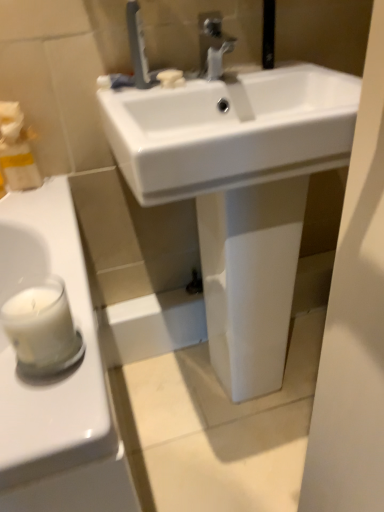
What do you see at coordinates (138, 47) in the screenshot? The image size is (384, 512). I see `satin nickel faucet at upper center, the 1th tap positioned from the left` at bounding box center [138, 47].

Identify the location of matte silver faucet at upper center, which is the 1th tap in right-to-left order. (213, 45).

What do you see at coordinates (239, 191) in the screenshot? I see `white glossy sink at center` at bounding box center [239, 191].

Locate an element on the screen. The width and height of the screenshot is (384, 512). satin nickel faucet at upper center, which is the second tap from right to left is located at coordinates (138, 47).

Considering the sizes of matte silver faucet at upper center, acting as the second tap starting from the left, and satin nickel faucet at upper center, the 1th tap positioned from the left, in the image, is matte silver faucet at upper center, acting as the second tap starting from the left, wider or thinner than satin nickel faucet at upper center, the 1th tap positioned from the left,?

Clearly, matte silver faucet at upper center, acting as the second tap starting from the left, has more width compared to satin nickel faucet at upper center, the 1th tap positioned from the left.

Looking at this image, from the image's perspective, between matte silver faucet at upper center, acting as the second tap starting from the left, and satin nickel faucet at upper center, the 1th tap positioned from the left, which one is located above?

satin nickel faucet at upper center, the 1th tap positioned from the left, appears higher in the image.

Is matte silver faucet at upper center, acting as the second tap starting from the left, completely or partially outside of satin nickel faucet at upper center, the 1th tap positioned from the left?

matte silver faucet at upper center, acting as the second tap starting from the left, lies outside satin nickel faucet at upper center, the 1th tap positioned from the left,'s area.

I want to click on the 1st tap to the right of the white wax candle at left, counting from the anchor's position, so click(138, 47).

Can you confirm if satin nickel faucet at upper center, which is the second tap from right to left, is positioned to the left of white wax candle at left?

In fact, satin nickel faucet at upper center, which is the second tap from right to left, is to the right of white wax candle at left.

From the image's perspective, which is above, satin nickel faucet at upper center, which is the second tap from right to left, or white wax candle at left?

satin nickel faucet at upper center, which is the second tap from right to left, from the image's perspective.

In terms of size, does satin nickel faucet at upper center, the 1th tap positioned from the left, appear bigger or smaller than white glossy sink at center?

satin nickel faucet at upper center, the 1th tap positioned from the left, is smaller than white glossy sink at center.

Based on the photo, which of these two, satin nickel faucet at upper center, the 1th tap positioned from the left, or white glossy sink at center, stands shorter?

satin nickel faucet at upper center, the 1th tap positioned from the left, is shorter.

Does satin nickel faucet at upper center, which is the second tap from right to left, have a greater width compared to white glossy sink at center?

No.

Based on the photo, is white wax candle at left wider or thinner than matte silver faucet at upper center, acting as the second tap starting from the left?

Considering their sizes, white wax candle at left looks slimmer than matte silver faucet at upper center, acting as the second tap starting from the left.

Is white wax candle at left looking in the opposite direction of matte silver faucet at upper center, acting as the second tap starting from the left?

white wax candle at left is not turned away from matte silver faucet at upper center, acting as the second tap starting from the left.

Does white wax candle at left have a greater height compared to matte silver faucet at upper center, acting as the second tap starting from the left?

Incorrect, the height of white wax candle at left is not larger of that of matte silver faucet at upper center, acting as the second tap starting from the left.

Is white glossy sink at center not close to matte silver faucet at upper center, which is the 1th tap in right-to-left order?

white glossy sink at center is actually quite close to matte silver faucet at upper center, which is the 1th tap in right-to-left order.

Considering the relative positions of white glossy sink at center and matte silver faucet at upper center, which is the 1th tap in right-to-left order, in the image provided, is white glossy sink at center behind matte silver faucet at upper center, which is the 1th tap in right-to-left order,?

No, white glossy sink at center is closer to the camera.

Is white glossy sink at center inside the boundaries of matte silver faucet at upper center, which is the 1th tap in right-to-left order, or outside?

white glossy sink at center exists outside the volume of matte silver faucet at upper center, which is the 1th tap in right-to-left order.

Identify the location of sink that is under the matte silver faucet at upper center, which is the 1th tap in right-to-left order (from a real-world perspective). (239, 191).

Is point (81, 343) positioned in front of point (182, 79)?

Yes, point (81, 343) is closer to viewer.

From the picture: Considering the positions of objects white wax candle at left and white matte soap at center in the image provided, who is more to the left, white wax candle at left or white matte soap at center?

Positioned to the left is white wax candle at left.

What's the angular difference between white wax candle at left and white matte soap at center's facing directions?

They differ by 27.8 degrees in their facing directions.

Are white wax candle at left and white matte soap at center located far from each other?

white wax candle at left is actually quite close to white matte soap at center.

Which of these two, white glossy sink at center or white matte soap at center, is bigger?

Bigger between the two is white glossy sink at center.

Is white glossy sink at center not close to white matte soap at center?

white glossy sink at center is actually quite close to white matte soap at center.

You are a GUI agent. You are given a task and a screenshot of the screen. Output one action in this format:
    pyautogui.click(x=<x>, y=<y>)
    Task: Click on the sink on the right of white matte soap at center
    This screenshot has height=512, width=384.
    Given the screenshot: What is the action you would take?
    pyautogui.click(x=239, y=191)

Would you say white glossy sink at center is inside or outside white matte soap at center?

white glossy sink at center cannot be found inside white matte soap at center.

You are a GUI agent. You are given a task and a screenshot of the screen. Output one action in this format:
    pyautogui.click(x=<x>, y=<y>)
    Task: Click on the tap that appears on the left of matte silver faucet at upper center, which is the 1th tap in right-to-left order
    This screenshot has height=512, width=384.
    Given the screenshot: What is the action you would take?
    pyautogui.click(x=138, y=47)

Locate an element on the screen. Image resolution: width=384 pixels, height=512 pixels. tap that is the 2nd object located above the white wax candle at left (from the image's perspective) is located at coordinates (x=138, y=47).

Considering their positions, is white glossy sink at center positioned further to matte silver faucet at upper center, acting as the second tap starting from the left, than white matte soap at center?

Based on the image, white glossy sink at center appears to be further to matte silver faucet at upper center, acting as the second tap starting from the left.

Which object lies further to the anchor point white glossy sink at center, white wax candle at left or matte silver faucet at upper center, acting as the second tap starting from the left?

The object further to white glossy sink at center is white wax candle at left.

Looking at the image, which one is located closer to white wax candle at left, white matte soap at center or white glossy sink at center?

Based on the image, white glossy sink at center appears to be nearer to white wax candle at left.

Which object lies further to the anchor point white matte soap at center, matte silver faucet at upper center, acting as the second tap starting from the left, or white wax candle at left?

white wax candle at left lies further to white matte soap at center than the other object.

Looking at the image, which one is located closer to white matte soap at center, white glossy sink at center or satin nickel faucet at upper center, the 1th tap positioned from the left?

satin nickel faucet at upper center, the 1th tap positioned from the left.

Estimate the real-world distances between objects in this image. Which object is closer to matte silver faucet at upper center, acting as the second tap starting from the left, white wax candle at left or satin nickel faucet at upper center, which is the second tap from right to left?

The object closer to matte silver faucet at upper center, acting as the second tap starting from the left, is satin nickel faucet at upper center, which is the second tap from right to left.

Based on the photo, estimate the real-world distances between objects in this image. Which object is closer to matte silver faucet at upper center, which is the 1th tap in right-to-left order, satin nickel faucet at upper center, which is the second tap from right to left, or white matte soap at center?

The object closer to matte silver faucet at upper center, which is the 1th tap in right-to-left order, is white matte soap at center.

Which object lies further to the anchor point satin nickel faucet at upper center, which is the second tap from right to left, matte silver faucet at upper center, which is the 1th tap in right-to-left order, or white glossy sink at center?

white glossy sink at center lies further to satin nickel faucet at upper center, which is the second tap from right to left, than the other object.

Locate an element on the screen. The height and width of the screenshot is (512, 384). tap between satin nickel faucet at upper center, the 1th tap positioned from the left, and white wax candle at left from top to bottom is located at coordinates (213, 45).

The image size is (384, 512). I want to click on soap between satin nickel faucet at upper center, which is the second tap from right to left, and white wax candle at left in the up-down direction, so [171, 78].

This screenshot has height=512, width=384. I want to click on sink between satin nickel faucet at upper center, the 1th tap positioned from the left, and white wax candle at left vertically, so tap(239, 191).

Locate an element on the screen. The width and height of the screenshot is (384, 512). soap between matte silver faucet at upper center, which is the 1th tap in right-to-left order, and white wax candle at left, in the vertical direction is located at coordinates (171, 78).